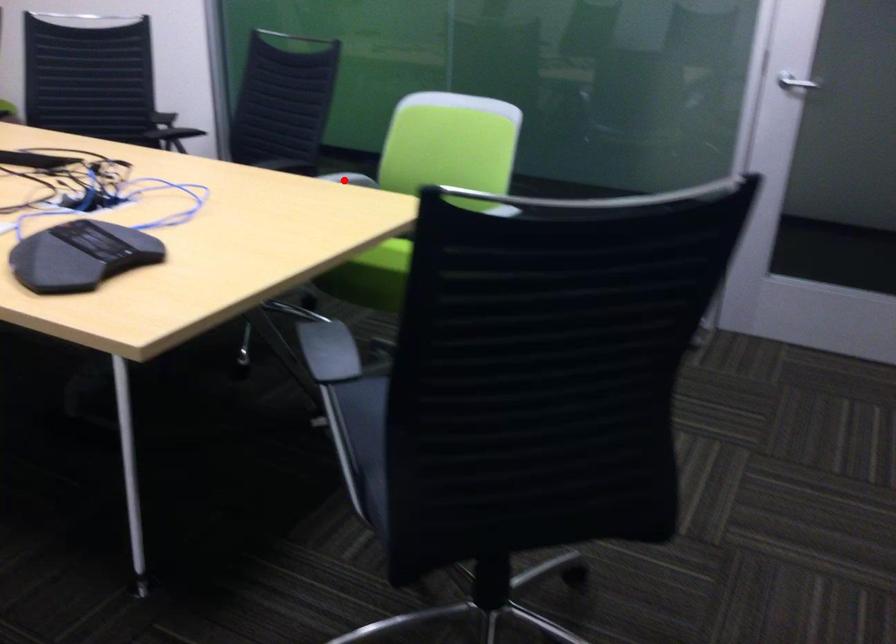
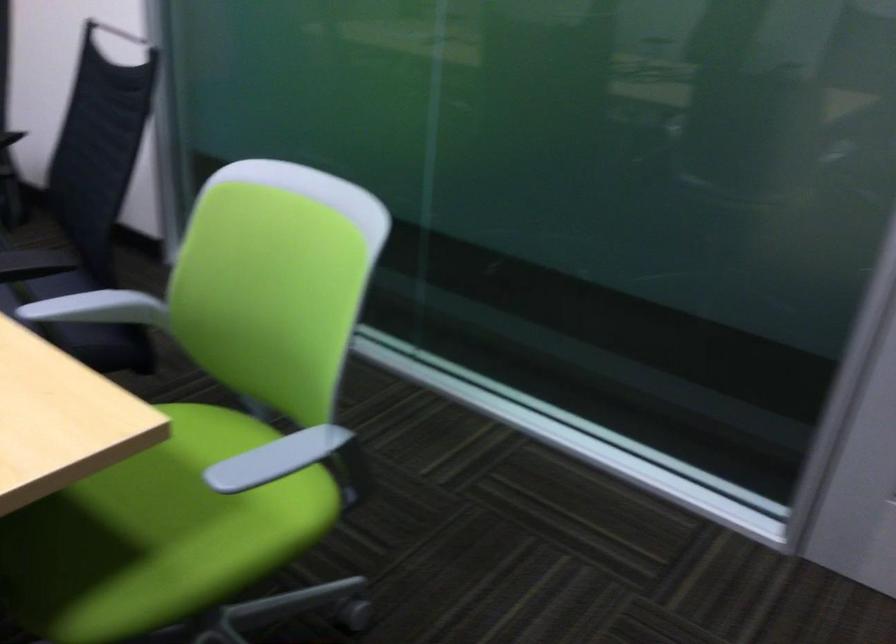
Where in the second image is the point corresponding to the highlighted location from the first image?

(97, 308)